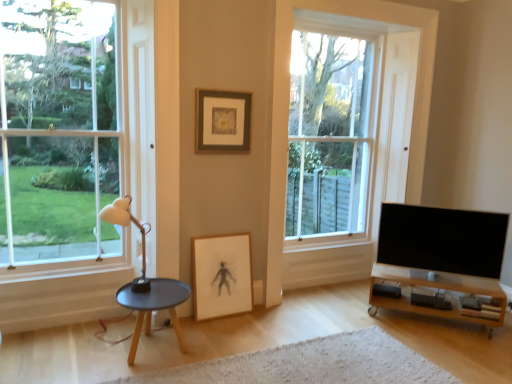
Find the location of `free space above matte black table at lower left (from a real-world perspective)`. free space above matte black table at lower left (from a real-world perspective) is located at coordinates (147, 294).